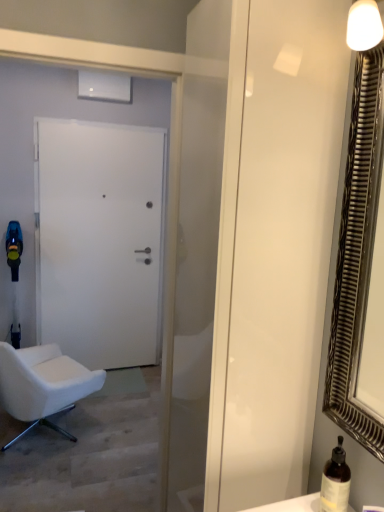
What do you see at coordinates (98, 240) in the screenshot?
I see `white matte door at center` at bounding box center [98, 240].

Where is `metallic silver mirror at right`? Image resolution: width=384 pixels, height=512 pixels. metallic silver mirror at right is located at coordinates (357, 254).

What is the approximate height of white fabric chair at left?

30.34 inches.

The height and width of the screenshot is (512, 384). Identify the location of white matte door at center. (98, 240).

Find the location of `bottle on the right of the transparent glass screen door at center`. bottle on the right of the transparent glass screen door at center is located at coordinates (335, 481).

Could you tell me if brown glass bottle at lower right is facing transparent glass screen door at center?

No, brown glass bottle at lower right is not aimed at transparent glass screen door at center.

Which is behind, point (342, 489) or point (289, 271)?

The point (289, 271) is farther.

From the image's perspective, is brown glass bottle at lower right located above transparent glass screen door at center?

No, from the image's perspective, brown glass bottle at lower right is not over transparent glass screen door at center.

Considering the positions of points (300, 302) and (87, 369), is point (300, 302) farther from camera compared to point (87, 369)?

No, (300, 302) is closer to viewer.

Is transparent glass screen door at center oriented away from white fabric chair at left?

transparent glass screen door at center is not turned away from white fabric chair at left.

How far apart are metallic silver mirror at right and brown glass bottle at lower right?

metallic silver mirror at right and brown glass bottle at lower right are 13.70 inches apart.

From the image's perspective, is metallic silver mirror at right positioned above or below brown glass bottle at lower right?

metallic silver mirror at right is above brown glass bottle at lower right.

Between point (338, 412) and point (333, 456), which one is positioned in front?

The point (338, 412) is in front.

Considering the sizes of objects brown glass bottle at lower right and white fabric chair at left in the image provided, who is taller, brown glass bottle at lower right or white fabric chair at left?

white fabric chair at left is taller.

Measure the distance between brown glass bottle at lower right and white fabric chair at left.

brown glass bottle at lower right and white fabric chair at left are 2.03 meters apart from each other.

Does point (349, 489) appear closer or farther from the camera than point (12, 380)?

Clearly, point (349, 489) is closer to the camera than point (12, 380).

Is white fabric chair at left surrounded by brown glass bottle at lower right?

Actually, white fabric chair at left is outside brown glass bottle at lower right.

You are a GUI agent. You are given a task and a screenshot of the screen. Output one action in this format:
    pyautogui.click(x=<x>, y=<y>)
    Task: Click on the chair below the metallic silver mirror at right (from the image's perspective)
    The image size is (384, 512).
    Given the screenshot: What is the action you would take?
    pyautogui.click(x=43, y=384)

Is white fabric chair at left far away from metallic silver mirror at right?

Yes.

Is white fabric chair at left outside of metallic silver mirror at right?

That's correct, white fabric chair at left is outside of metallic silver mirror at right.

From a real-world perspective, is white fabric chair at left beneath metallic silver mirror at right?

Correct, in the physical world, white fabric chair at left is lower than metallic silver mirror at right.

Which object is closer to the camera, white fabric chair at left or brown glass bottle at lower right?

Positioned in front is brown glass bottle at lower right.

Can you confirm if white fabric chair at left is bigger than brown glass bottle at lower right?

Correct, white fabric chair at left is larger in size than brown glass bottle at lower right.

Is brown glass bottle at lower right not close to metallic silver mirror at right?

That's not correct — brown glass bottle at lower right is a little close to metallic silver mirror at right.

How different are the orientations of brown glass bottle at lower right and metallic silver mirror at right in degrees?

37.4 degrees separate the facing orientations of brown glass bottle at lower right and metallic silver mirror at right.

From a real-world perspective, between brown glass bottle at lower right and metallic silver mirror at right, who is vertically lower?

brown glass bottle at lower right is physically lower.

Which is more to the right, brown glass bottle at lower right or metallic silver mirror at right?

metallic silver mirror at right is more to the right.

This screenshot has height=512, width=384. What are the coordinates of `bottle that appears on the right of transparent glass screen door at center` in the screenshot? It's located at (335, 481).

The width and height of the screenshot is (384, 512). Find the location of `chair located below the transparent glass screen door at center (from the image's perspective)`. chair located below the transparent glass screen door at center (from the image's perspective) is located at coordinates (43, 384).

When comparing their distances from white fabric chair at left, does white matte door at center or transparent glass screen door at center seem closer?

Among the two, white matte door at center is located nearer to white fabric chair at left.

Based on their spatial positions, is white fabric chair at left or white matte door at center closer to brown glass bottle at lower right?

Based on the image, white fabric chair at left appears to be nearer to brown glass bottle at lower right.

Looking at the image, which one is located closer to metallic silver mirror at right, white fabric chair at left or brown glass bottle at lower right?

brown glass bottle at lower right is positioned closer to the anchor metallic silver mirror at right.

Looking at the image, which one is located further to brown glass bottle at lower right, metallic silver mirror at right or white fabric chair at left?

Among the two, white fabric chair at left is located further to brown glass bottle at lower right.

From the image, which object appears to be nearer to metallic silver mirror at right, transparent glass screen door at center or white matte door at center?

transparent glass screen door at center lies closer to metallic silver mirror at right than the other object.

Considering their positions, is white matte door at center positioned closer to brown glass bottle at lower right than white fabric chair at left?

white fabric chair at left is closer to brown glass bottle at lower right.

Considering their positions, is white fabric chair at left positioned closer to white matte door at center than brown glass bottle at lower right?

white fabric chair at left is positioned closer to the anchor white matte door at center.

Looking at the image, which one is located further to white fabric chair at left, brown glass bottle at lower right or white matte door at center?

Among the two, brown glass bottle at lower right is located further to white fabric chair at left.

Where is `chair between brown glass bottle at lower right and white matte door at center from front to back`? chair between brown glass bottle at lower right and white matte door at center from front to back is located at coordinates (43, 384).

Where is `bottle positioned between transparent glass screen door at center and white fabric chair at left from near to far`? bottle positioned between transparent glass screen door at center and white fabric chair at left from near to far is located at coordinates (335, 481).

This screenshot has height=512, width=384. What are the coordinates of `screen door positioned between metallic silver mirror at right and white fabric chair at left from near to far` in the screenshot? It's located at (274, 244).

Find the location of a particular element. screen door that lies between metallic silver mirror at right and brown glass bottle at lower right from top to bottom is located at coordinates (274, 244).